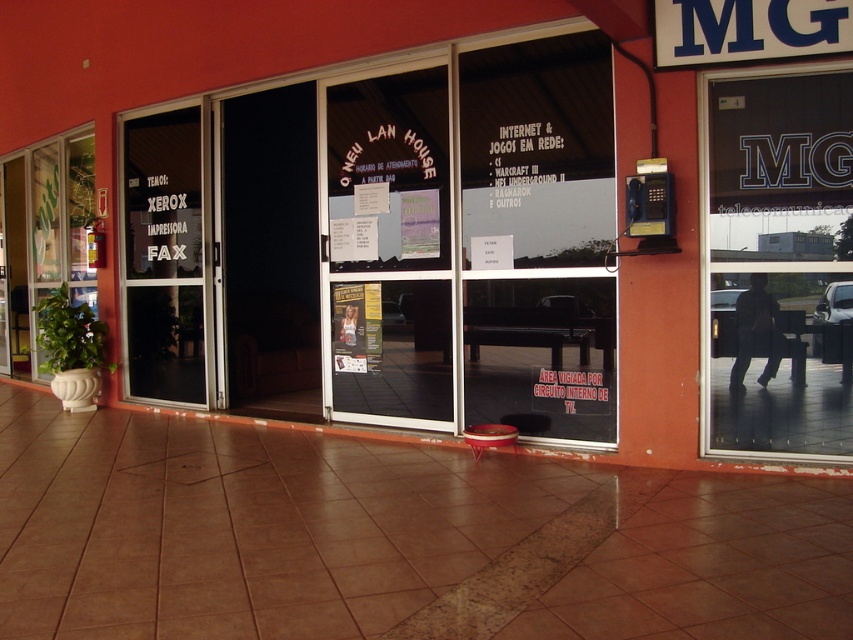
Question: Is transparent glass door at upper right behind transparent glass door at center?

Choices:
 (A) no
 (B) yes

Answer: (A)

Question: Which is farther from the transparent glass door at upper right?

Choices:
 (A) transparent glass door at center
 (B) green leafy plant at left

Answer: (B)

Question: Where is transparent glass door at upper right located in relation to transparent glass door at center in the image?

Choices:
 (A) right
 (B) left

Answer: (A)

Question: Estimate the real-world distances between objects in this image. Which object is farther from the transparent glass door at center?

Choices:
 (A) green leafy plant at left
 (B) transparent glass door at upper right

Answer: (B)

Question: Can you confirm if transparent glass door at center is positioned to the right of green leafy plant at left?

Choices:
 (A) yes
 (B) no

Answer: (A)

Question: Which point appears closest to the camera in this image?

Choices:
 (A) (131, 220)
 (B) (32, 211)

Answer: (A)